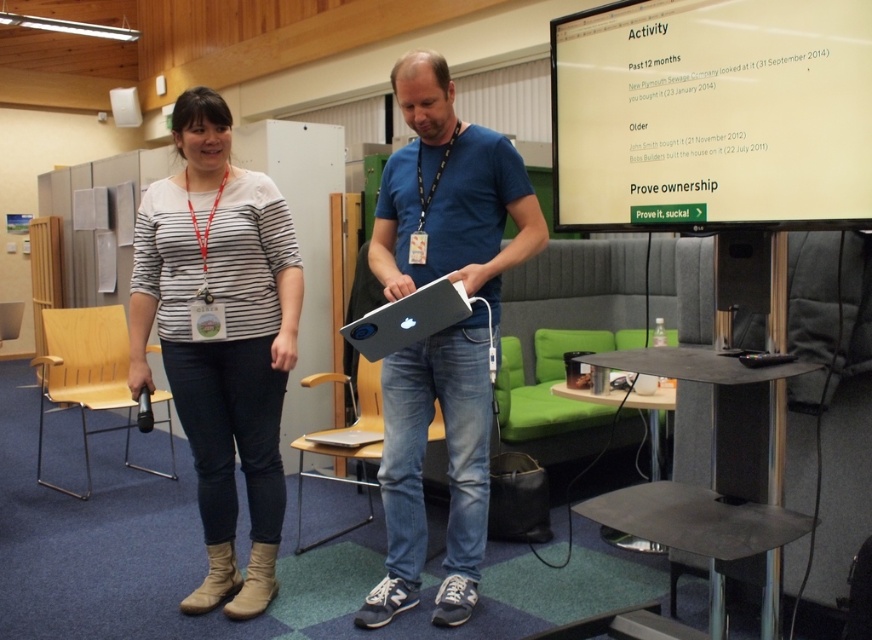
Consider the image. You are organizing a conference and need to arrange the items in the image for a presentation. The microphone and laptop must be placed on a table. Given that the matte striped shirt at center is below the matte white laptop at center in the image, where should you position the microphone and laptop relative to each other on the table?

Since the matte striped shirt at center is below the matte white laptop at center in the image, the microphone should be placed below the laptop on the table to maintain the same spatial relationship.

You are organizing a conference and need to place a new speaker stand at point (443, 330). The existing setup has a matte black laptop at center. Where should you position the speaker stand relative to the matte black laptop at center?

The speaker stand should be positioned at the same location as the matte black laptop at center since the laptop is already located at point (443, 330).

You are organizing a tech event and need to arrange two laptops for a presentation. The laptops are the matte black laptop at center and the matte white laptop at center. According to the image, which laptop should be placed to the left to follow the existing setup?

The matte white laptop at center should be placed to the left since the matte black laptop at center is positioned to its right in the image.